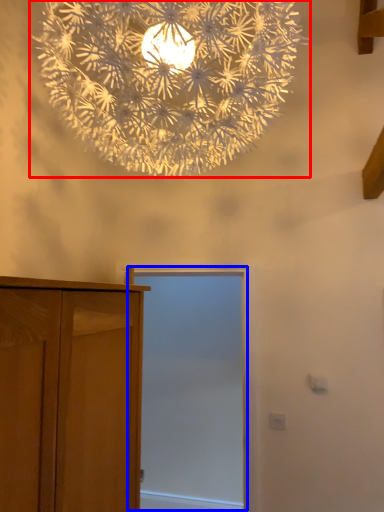
Question: Which of the following is the farthest to the observer, lamp (highlighted by a red box) or screen door (highlighted by a blue box)?

Choices:
 (A) lamp
 (B) screen door

Answer: (B)